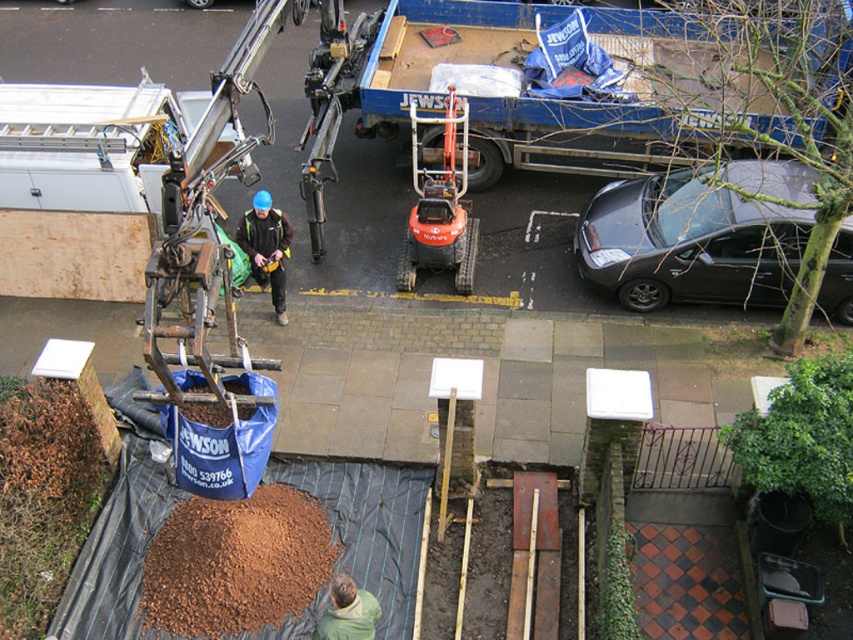
Does shiny black car at right appear under orange rubberized compact tractor at center?

Correct, shiny black car at right is located below orange rubberized compact tractor at center.

Does shiny black car at right have a smaller size compared to orange rubberized compact tractor at center?

Actually, shiny black car at right might be larger than orange rubberized compact tractor at center.

Locate an element on the screen. The image size is (853, 640). shiny black car at right is located at coordinates (688, 243).

Looking at this image, can you confirm if blue fabric truck at upper center is positioned below shiny black car at right?

Actually, blue fabric truck at upper center is above shiny black car at right.

Who is lower down, blue fabric truck at upper center or shiny black car at right?

shiny black car at right is lower down.

Find the location of a particular element. This screenshot has width=853, height=640. blue fabric truck at upper center is located at coordinates (531, 92).

Can you confirm if blue fabric truck at upper center is smaller than brown mulch at lower center?

Incorrect, blue fabric truck at upper center is not smaller in size than brown mulch at lower center.

Is blue fabric truck at upper center shorter than brown mulch at lower center?

No, blue fabric truck at upper center is not shorter than brown mulch at lower center.

Is point (676, 93) behind point (148, 596)?

Yes, it is behind point (148, 596).

Where is `blue fabric truck at upper center`? The image size is (853, 640). blue fabric truck at upper center is located at coordinates (531, 92).